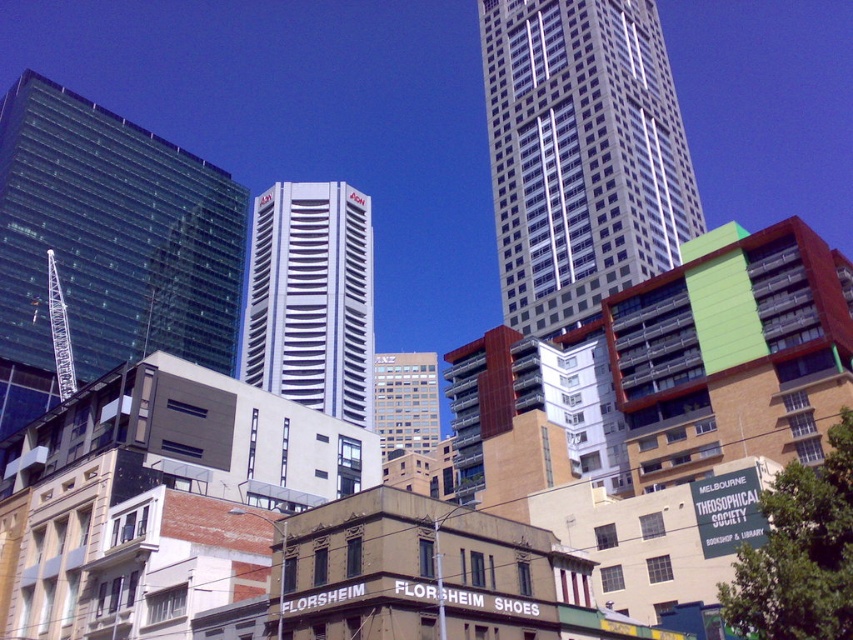
Question: Which of the following is the farthest from the observer?

Choices:
 (A) white glass skyscraper at center
 (B) white glossy building at center

Answer: (B)

Question: Is white glass skyscraper at center above white glossy building at center?

Choices:
 (A) no
 (B) yes

Answer: (B)

Question: Which of the following is the closest to the observer?

Choices:
 (A) (322, 202)
 (B) (509, 156)

Answer: (B)

Question: Is white glass skyscraper at center positioned before white glossy building at center?

Choices:
 (A) yes
 (B) no

Answer: (A)

Question: Is white glass skyscraper at center closer to the viewer compared to white glossy building at center?

Choices:
 (A) yes
 (B) no

Answer: (A)